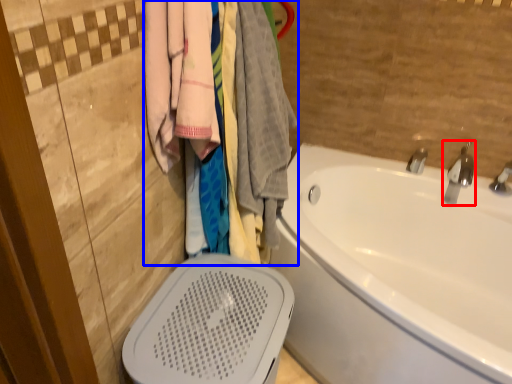
Question: Among these objects, which one is nearest to the camera, tap (highlighted by a red box) or closet (highlighted by a blue box)?

Choices:
 (A) tap
 (B) closet

Answer: (B)